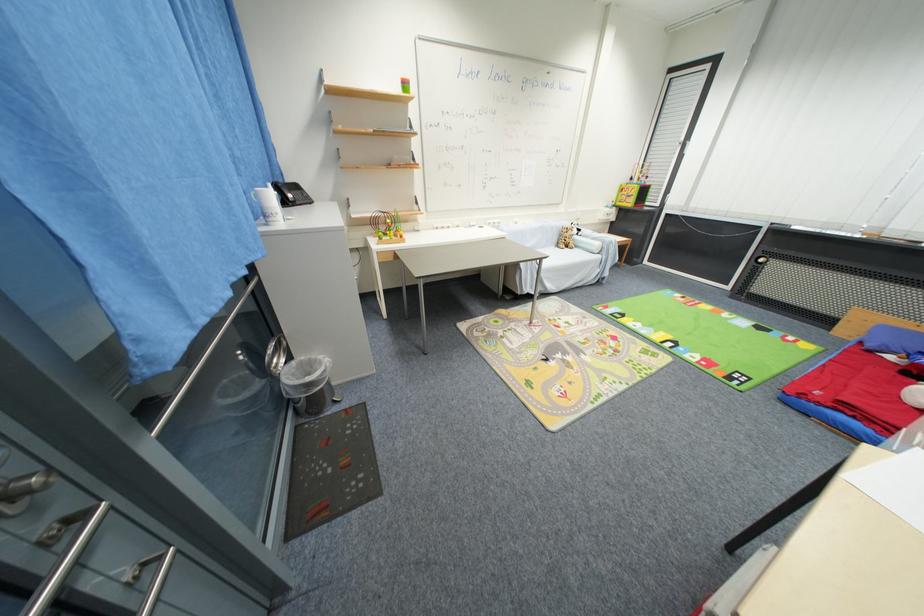
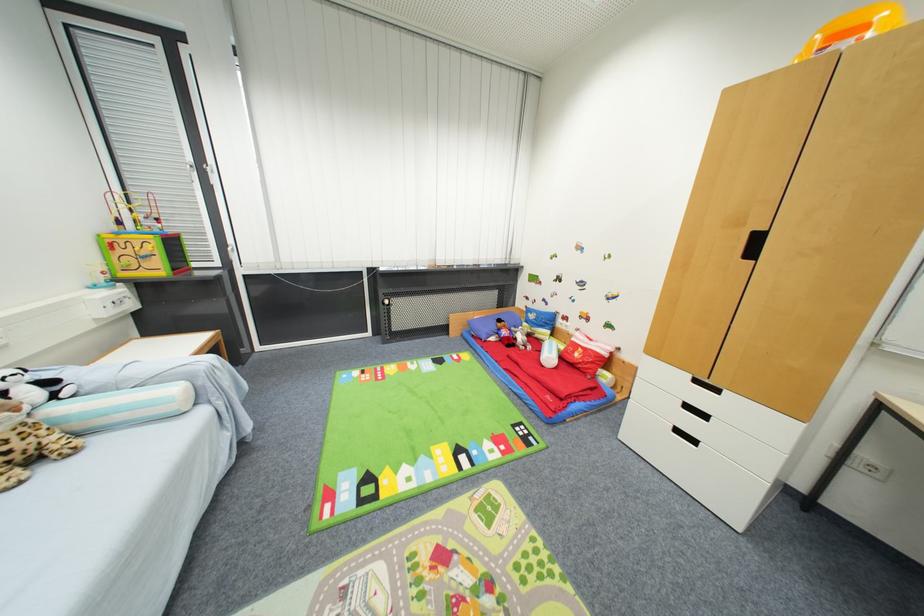
The point at (584, 232) is marked in the first image. Where is the corresponding point in the second image?

(54, 384)